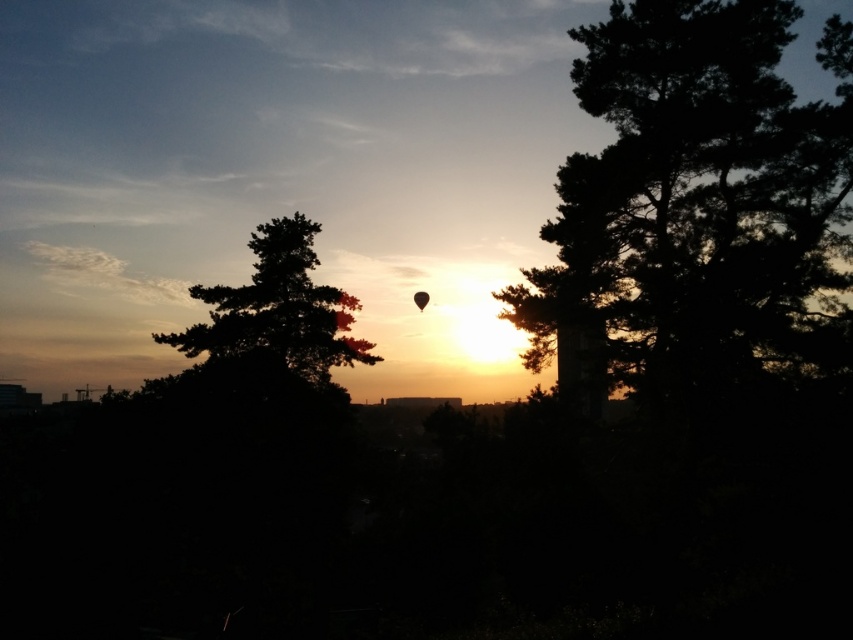
Question: Does silhouette tree at left appear on the right side of transparent black balloon at center?

Choices:
 (A) no
 (B) yes

Answer: (A)

Question: From the image, what is the correct spatial relationship of dark green textured tree at right in relation to translucent orange balloon at center?

Choices:
 (A) above
 (B) below

Answer: (A)

Question: Does dark green textured tree at right appear on the right side of transparent black balloon at center?

Choices:
 (A) no
 (B) yes

Answer: (B)

Question: Which point is closer to the camera?

Choices:
 (A) silhouette tree at left
 (B) dark green textured tree at right
 (C) transparent black balloon at center
 (D) translucent orange balloon at center

Answer: (B)

Question: Which object is the farthest from the dark green textured tree at right?

Choices:
 (A) translucent orange balloon at center
 (B) transparent black balloon at center
 (C) silhouette tree at left

Answer: (B)

Question: Among these points, which one is nearest to the camera?

Choices:
 (A) (421, 308)
 (B) (196, 346)
 (C) (335, 314)

Answer: (B)